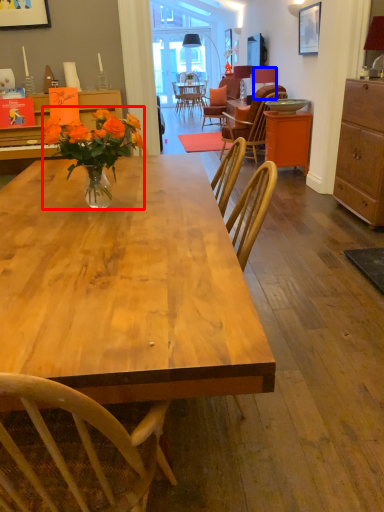
Question: Which object is further to the camera taking this photo, floral arrangement (highlighted by a red box) or lamp (highlighted by a blue box)?

Choices:
 (A) floral arrangement
 (B) lamp

Answer: (B)